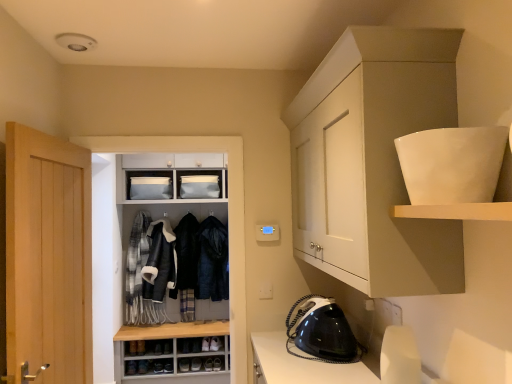
Question: From a real-world perspective, is leather jacket at center, arranged as the third clothing when viewed from the right, above or below plaid wool scarf at center left, which is the fourth clothing in right-to-left order?

Choices:
 (A) below
 (B) above

Answer: (B)

Question: Is leather jacket at center, placed as the 2th clothing when sorted from left to right, taller or shorter than plaid wool scarf at center left, which ranks as the first clothing in left-to-right order?

Choices:
 (A) short
 (B) tall

Answer: (A)

Question: Which object is the farthest from the velvet black coat at center, acting as the 3th clothing starting from the left?

Choices:
 (A) white glossy bowl at upper right, marked as the 2th shelf in a bottom-to-top arrangement
 (B) light wood door at left
 (C) white matte cabinet at upper right, acting as the second cabinetry starting from the back
 (D) dark blue fur-lined coat at center, which ranks as the fourth clothing in left-to-right order
 (E) white matte shelf at upper right, the 1th shelf ordered from the bottom

Answer: (A)

Question: Which object is positioned farthest from the white matte cabinet at upper right, the 2th cabinetry when ordered from left to right?

Choices:
 (A) light wood door at left
 (B) matte white cabinet at center, marked as the 2th cabinetry in a front-to-back arrangement
 (C) white glossy bowl at upper right, which is counted as the 1th shelf, starting from the top
 (D) plaid wool scarf at center left, which ranks as the first clothing in left-to-right order
 (E) velvet black coat at center, acting as the 3th clothing starting from the left

Answer: (D)